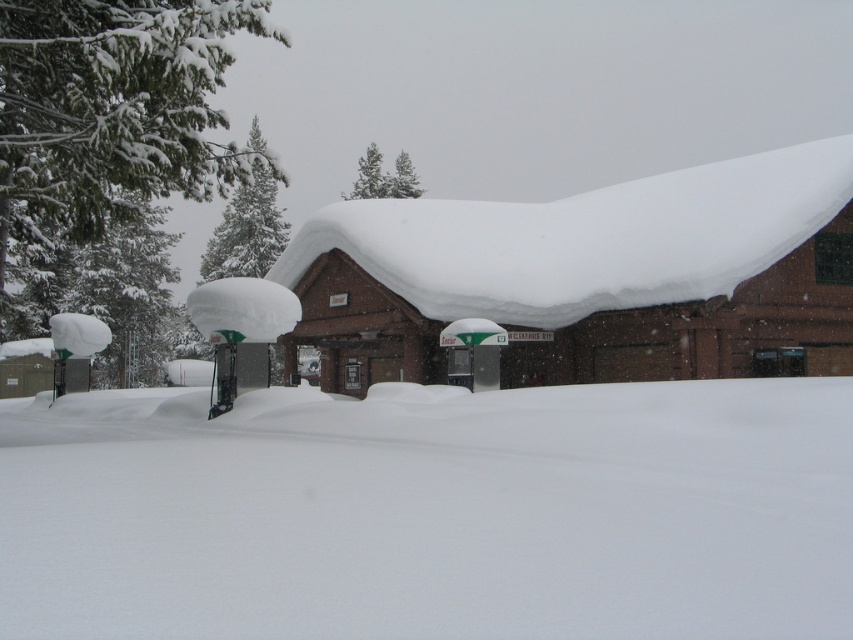
Is point (86, 134) farther from viewer compared to point (397, 195)?

No, (86, 134) is in front of (397, 195).

Is point (206, 45) more distant than point (393, 163)?

No.

At what (x,y) coordinates should I click in order to perform the action: click on green textured snow at left. Please return your answer as a coordinate pair (x, y). Looking at the image, I should click on (109, 113).

The width and height of the screenshot is (853, 640). What do you see at coordinates (431, 513) in the screenshot? I see `white fluffy snow at lower center` at bounding box center [431, 513].

Can you confirm if white fluffy snow at lower center is thinner than snow-covered pine trees at upper center?

In fact, white fluffy snow at lower center might be wider than snow-covered pine trees at upper center.

Between point (692, 584) and point (363, 184), which one is positioned behind?

Positioned behind is point (363, 184).

Locate an element on the screen. white fluffy snow at lower center is located at coordinates (431, 513).

Who is taller, white fluffy snow at lower center or brown brick cabin at center?

Standing taller between the two is brown brick cabin at center.

Describe the element at coordinates (431, 513) in the screenshot. I see `white fluffy snow at lower center` at that location.

This screenshot has height=640, width=853. Describe the element at coordinates (431, 513) in the screenshot. I see `white fluffy snow at lower center` at that location.

The image size is (853, 640). I want to click on white fluffy snow at lower center, so click(x=431, y=513).